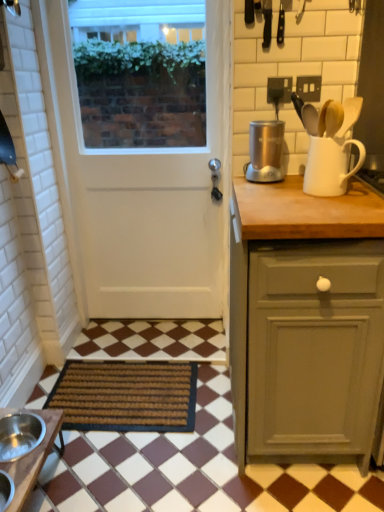
Question: Can you confirm if matte gray cabinet at right is wider than white matte jug at upper right?

Choices:
 (A) no
 (B) yes

Answer: (B)

Question: Is the depth of matte gray cabinet at right less than that of white matte jug at upper right?

Choices:
 (A) yes
 (B) no

Answer: (A)

Question: Is matte gray cabinet at right at the left side of white matte jug at upper right?

Choices:
 (A) no
 (B) yes

Answer: (B)

Question: Does matte gray cabinet at right turn towards white matte jug at upper right?

Choices:
 (A) yes
 (B) no

Answer: (B)

Question: Can you confirm if matte gray cabinet at right is smaller than white matte jug at upper right?

Choices:
 (A) no
 (B) yes

Answer: (A)

Question: Is white matte jug at upper right surrounded by matte gray cabinet at right?

Choices:
 (A) yes
 (B) no

Answer: (B)

Question: From a real-world perspective, is matte gray cabinet at right over brown wooden table at lower left?

Choices:
 (A) yes
 (B) no

Answer: (A)

Question: Is matte gray cabinet at right facing away from brown wooden table at lower left?

Choices:
 (A) no
 (B) yes

Answer: (A)

Question: Is matte gray cabinet at right bigger than brown wooden table at lower left?

Choices:
 (A) no
 (B) yes

Answer: (B)

Question: Is matte gray cabinet at right further to camera compared to brown wooden table at lower left?

Choices:
 (A) yes
 (B) no

Answer: (B)

Question: Is matte gray cabinet at right with brown wooden table at lower left?

Choices:
 (A) no
 (B) yes

Answer: (A)

Question: Is matte gray cabinet at right not within brown wooden table at lower left?

Choices:
 (A) no
 (B) yes

Answer: (B)

Question: Is brown woven mat at lower left positioned beyond the bounds of white matte jug at upper right?

Choices:
 (A) yes
 (B) no

Answer: (A)